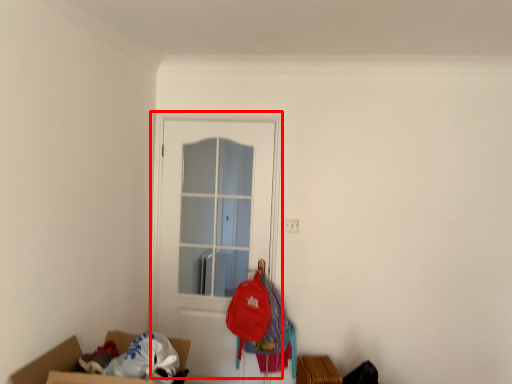
Question: In this image, where is door (annotated by the red box) located relative to clothing?

Choices:
 (A) left
 (B) right

Answer: (A)